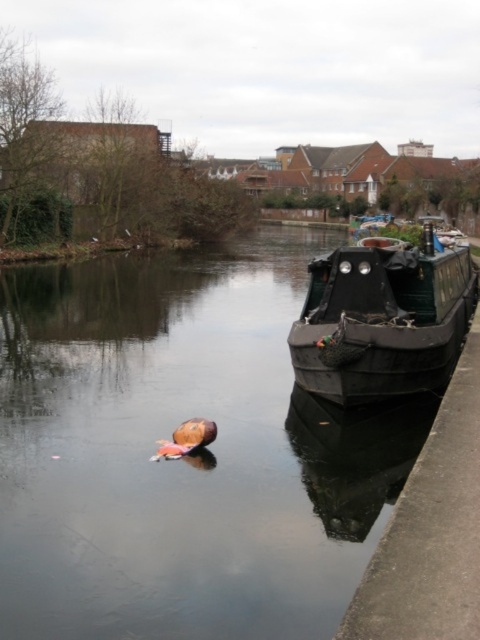
Question: Is dark green wood boat at right thinner than black matte boat at right?

Choices:
 (A) yes
 (B) no

Answer: (B)

Question: Which of the following is the farthest from the observer?

Choices:
 (A) pyautogui.click(x=367, y=374)
 (B) pyautogui.click(x=249, y=240)

Answer: (B)

Question: Among these points, which one is nearest to the camera?

Choices:
 (A) (95, 518)
 (B) (396, 285)

Answer: (A)

Question: Does dark green wood boat at right have a lesser width compared to black matte boat at right?

Choices:
 (A) yes
 (B) no

Answer: (B)

Question: Can you confirm if dark green wood boat at right is wider than black matte boat at right?

Choices:
 (A) yes
 (B) no

Answer: (A)

Question: Among these points, which one is nearest to the camera?

Choices:
 (A) (21, 548)
 (B) (346, 305)

Answer: (A)